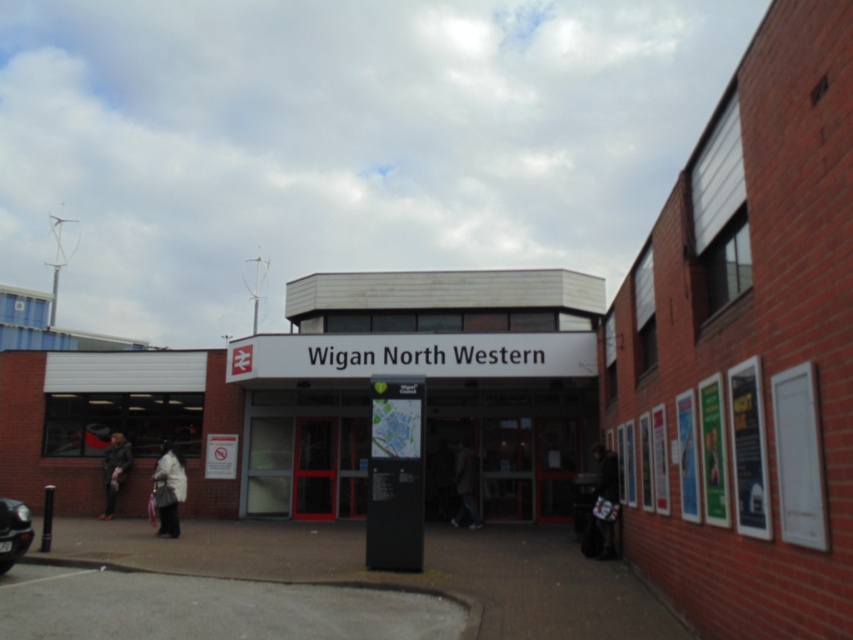
You are a photographer standing at the entrance of Wigan North Western railway station. You notice a shiny black car at lower left and a dark gray coat at lower left. Which object takes up more space in your photo?

The dark gray coat at lower left takes up more space in the photo because the shiny black car at lower left occupies less space than it.

You are a traveler who just arrived at Wigan North Western railway station. You see a dark gray coat at lower left and a dark gray jacket at center. Which item is taller?

The dark gray coat at lower left is much taller as the dark gray jacket at center.